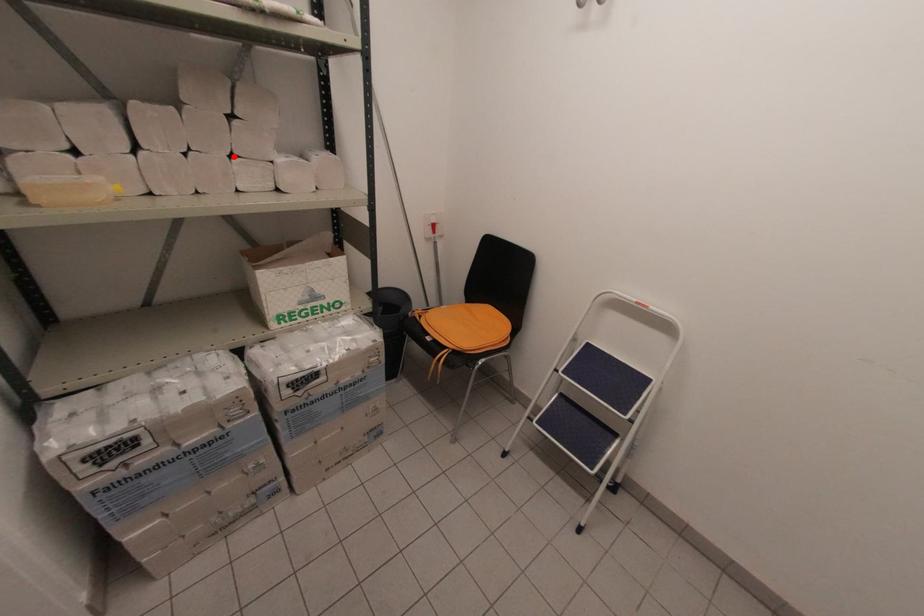
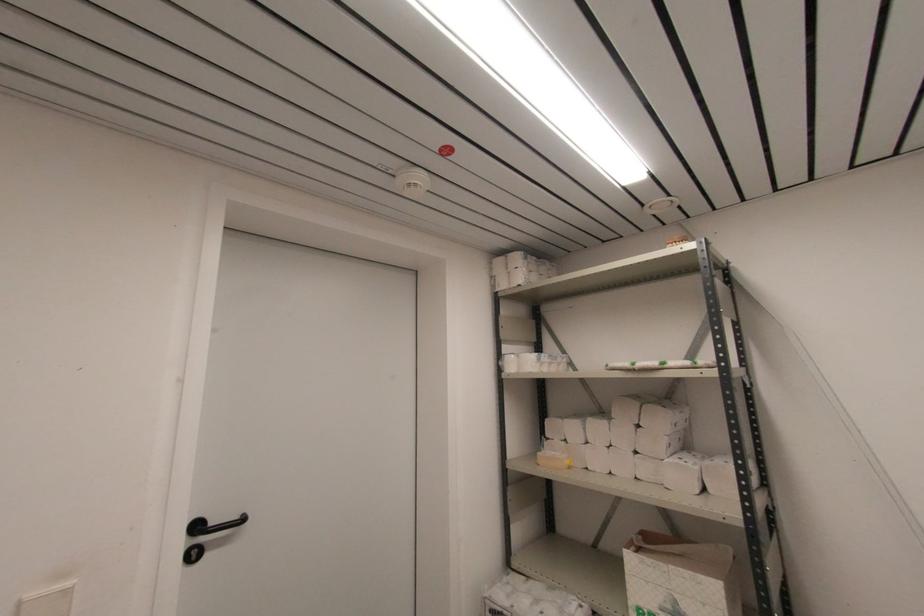
Find the pixel in the second image that matches the highlighted location in the first image.

(637, 453)